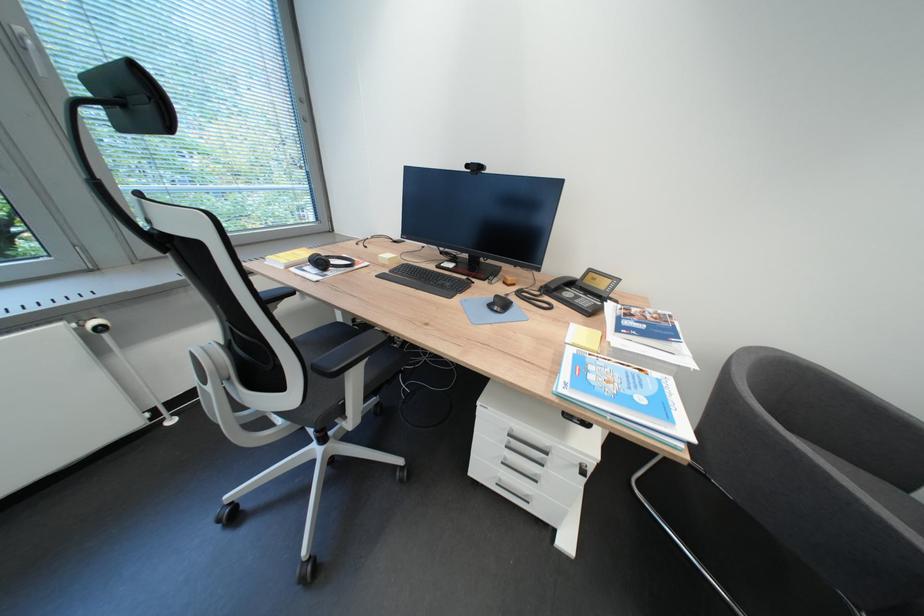
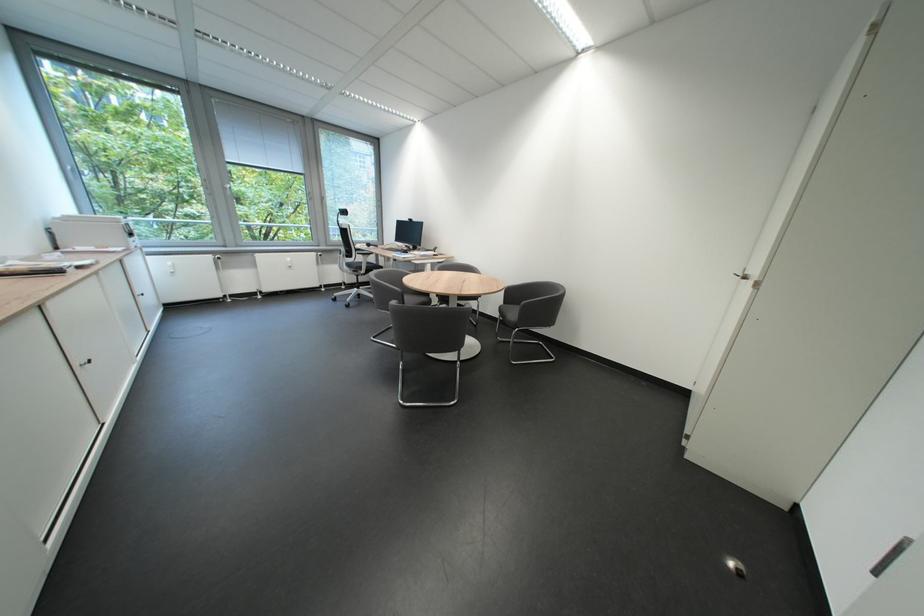
What movement of the cameraman would produce the second image?

The movement direction of the cameraman is right, backward.